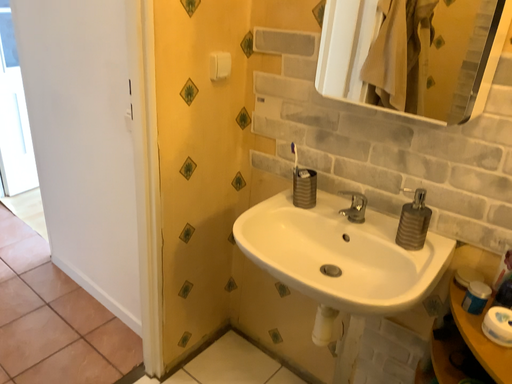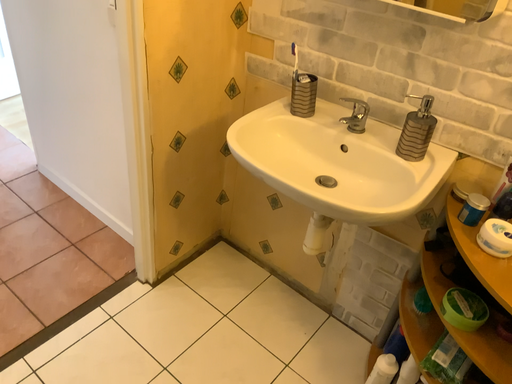
Question: How did the camera likely rotate when shooting the video?

Choices:
 (A) rotated downward
 (B) rotated upward

Answer: (A)